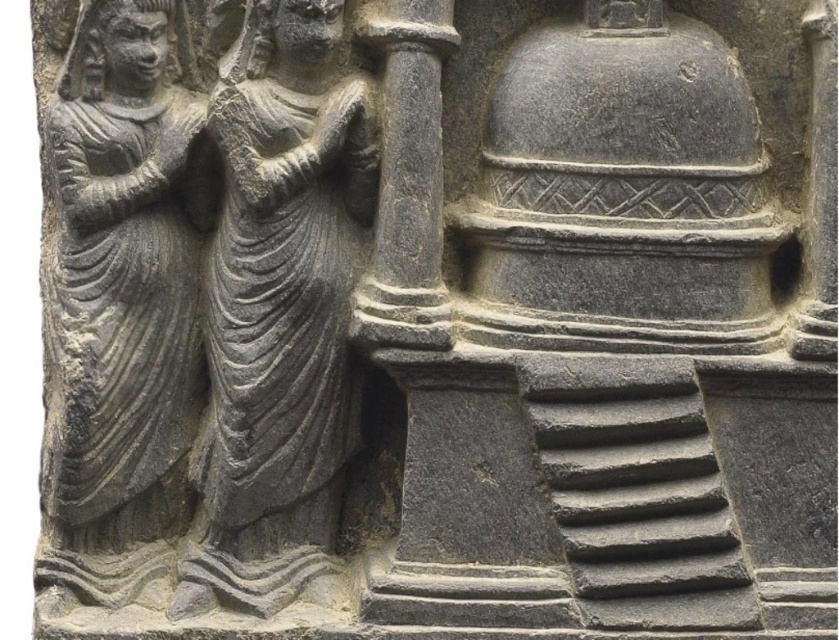
Between point (314, 52) and point (186, 145), which one is positioned in front?

Positioned in front is point (314, 52).

I want to click on gray stone statue at center, so click(x=280, y=276).

Where is `gray stone statue at center`? gray stone statue at center is located at coordinates coord(280,276).

Who is lower down, gray stone statue at left or gray stone pillar at center?

gray stone statue at left is below.

Can you confirm if gray stone statue at left is taller than gray stone pillar at center?

Yes, gray stone statue at left is taller than gray stone pillar at center.

Where is `gray stone statue at left`? gray stone statue at left is located at coordinates (118, 278).

Which of these two, gray stone statue at center or gray stone pillar at center, stands shorter?

gray stone pillar at center is shorter.

Does gray stone statue at center have a lesser height compared to gray stone pillar at center?

No.

Between point (272, 404) and point (400, 19), which one is positioned behind?

Positioned behind is point (272, 404).

Identify the location of gray stone statue at center. (280, 276).